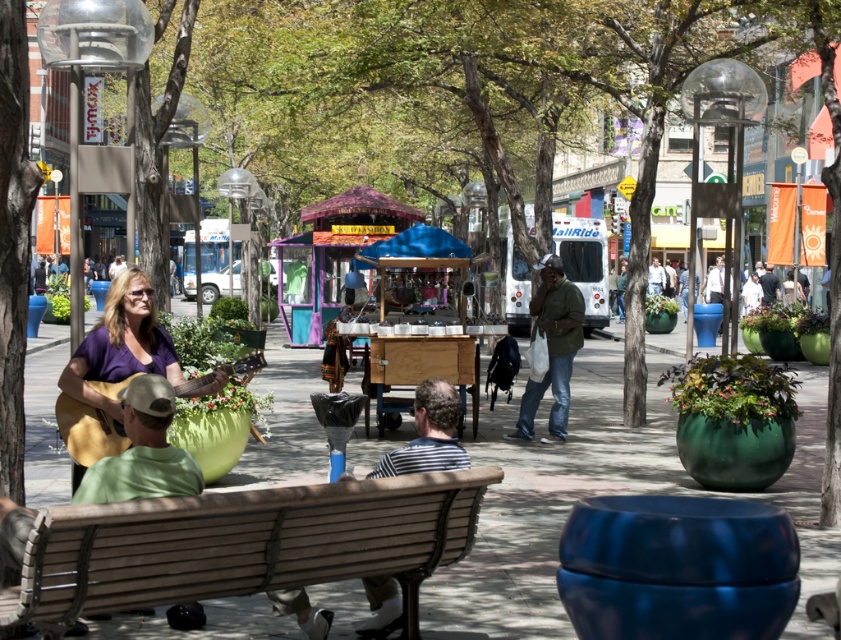
Question: In this image, where is green fabric hat at center located relative to light brown leather jacket at center?

Choices:
 (A) left
 (B) right

Answer: (A)

Question: Which object is farther from the camera taking this photo?

Choices:
 (A) light brown leather jacket at center
 (B) matte purple shirt at center
 (C) striped fabric shirt at center

Answer: (A)

Question: Which of the following is the farthest from the observer?

Choices:
 (A) matte purple shirt at center
 (B) dark gray fabric jacket at center
 (C) light brown leather jacket at center

Answer: (B)

Question: Does matte purple shirt at center lie behind dark gray fabric jacket at center?

Choices:
 (A) yes
 (B) no

Answer: (B)

Question: Estimate the real-world distances between objects in this image. Which object is closer to the light brown leather jacket at center?

Choices:
 (A) matte purple shirt at center
 (B) dark gray fabric jacket at center
 (C) green fabric hat at center

Answer: (B)

Question: Is dark gray fabric jacket at center further to the viewer compared to light brown leather jacket at center?

Choices:
 (A) no
 (B) yes

Answer: (B)